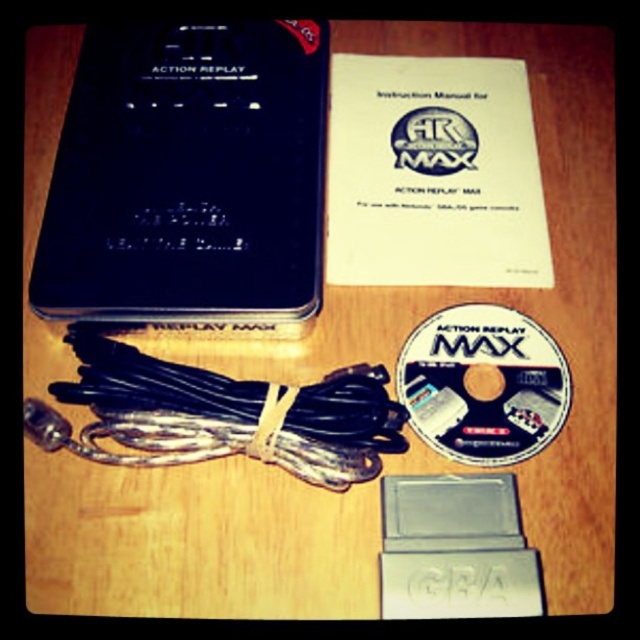
Question: Which point is farther to the camera?

Choices:
 (A) matte white cd at center
 (B) black matte action replay max at upper left

Answer: (B)

Question: Can you confirm if black matte action replay max at upper left is thinner than matte white cd at center?

Choices:
 (A) yes
 (B) no

Answer: (B)

Question: In this image, where is black matte action replay max at upper left located relative to matte white cd at center?

Choices:
 (A) above
 (B) below

Answer: (A)

Question: Is black matte action replay max at upper left to the right of matte white cd at center from the viewer's perspective?

Choices:
 (A) yes
 (B) no

Answer: (B)